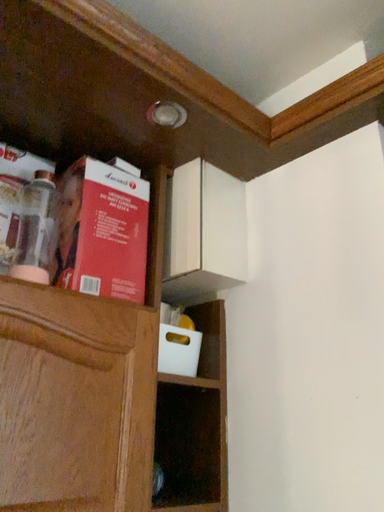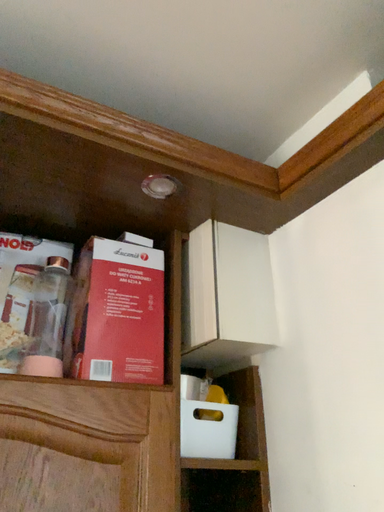
Question: Which way did the camera rotate in the video?

Choices:
 (A) rotated right
 (B) rotated left

Answer: (B)